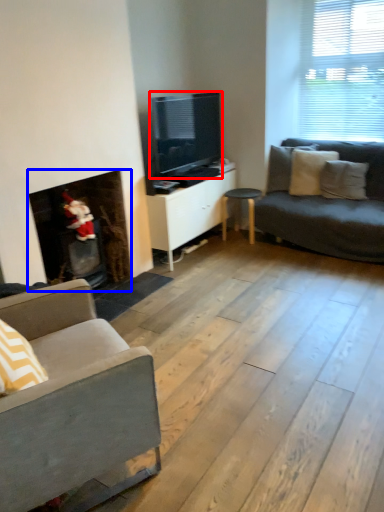
Question: Which object is closer to the camera taking this photo, television (highlighted by a red box) or fireplace (highlighted by a blue box)?

Choices:
 (A) television
 (B) fireplace

Answer: (B)